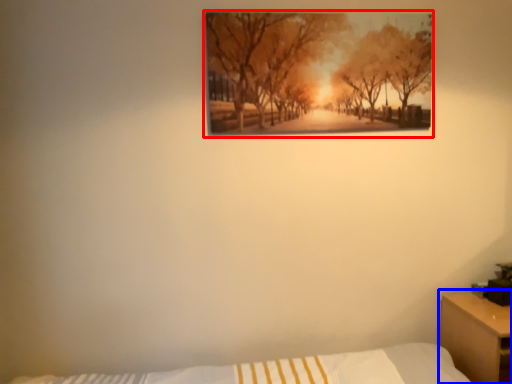
Question: Which object is closer to the camera taking this photo, picture frame (highlighted by a red box) or nightstand (highlighted by a blue box)?

Choices:
 (A) picture frame
 (B) nightstand

Answer: (B)